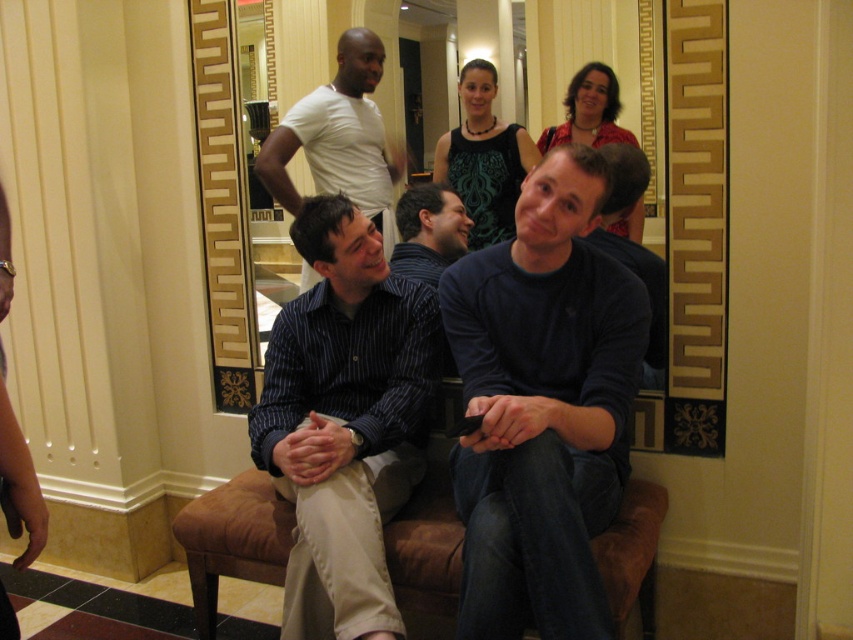
You are organizing a clothing donation drive and need to sort items by size. You have a dark blue sweater at center and a blue striped shirt at center in front of you. Which item should you place in the small size bin?

The dark blue sweater at center has a smaller size compared to the blue striped shirt at center, so it should be placed in the small size bin.